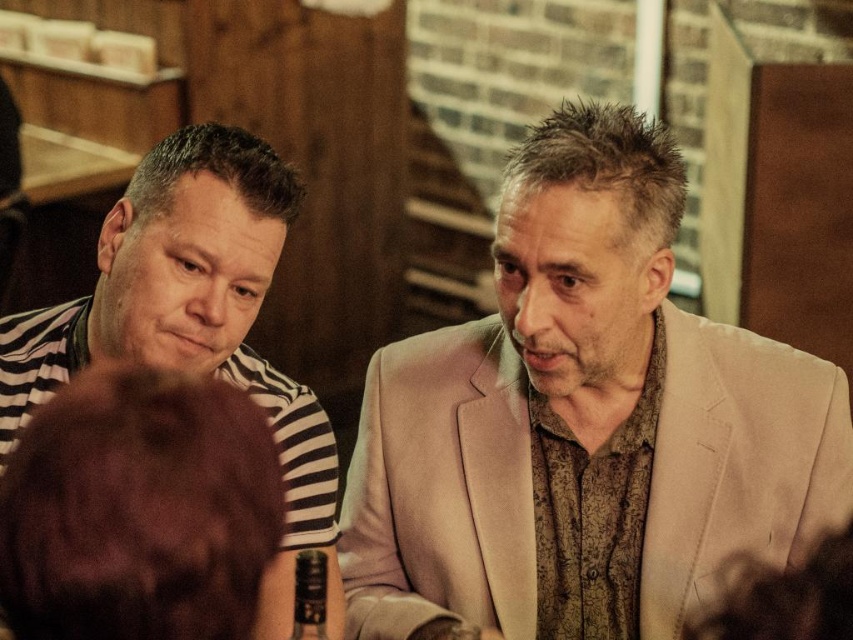
Consider the image. You are a photographer trying to capture a candid shot of the dark brown fur at lower left and the striped fabric shirt at left. Since you want both subjects to be in focus, which one should you adjust your camera focus on first?

The dark brown fur at lower left has a lesser height compared to striped fabric shirt at left, so you should focus on the striped fabric shirt at left first as it is closer to the camera.

You are a photographer trying to capture a clear shot of both the light beige suit at center and the dark brown fur at lower left. Since you can only focus on one subject at a time, which subject should you focus on to ensure the other remains in the background?

You should focus on the light beige suit at center because it is taller than the dark brown fur at lower left, so the dark brown fur at lower left will naturally be in the background and still somewhat visible.